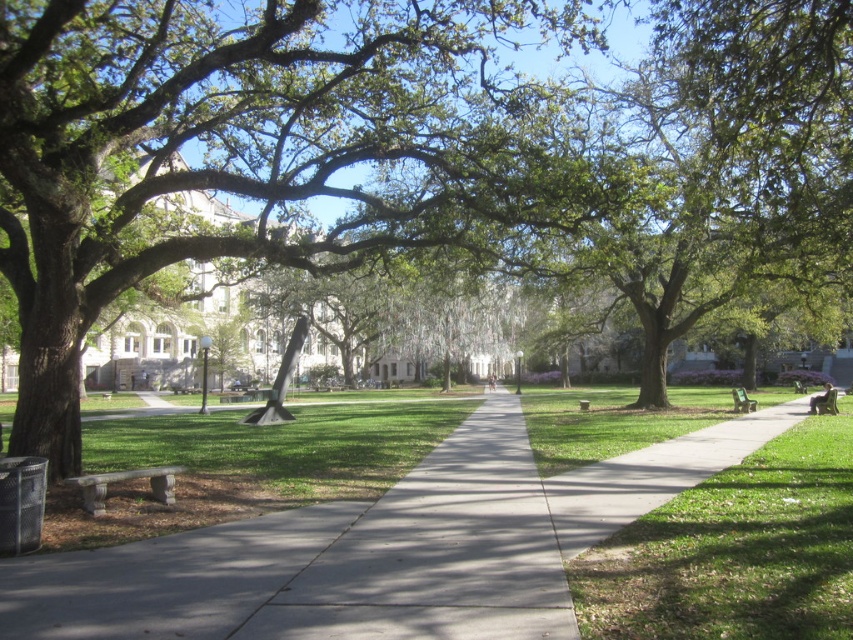
Does green leafy tree at center appear under green wooden bench at right?

No.

Is point (263, 221) in front of point (746, 396)?

Yes, point (263, 221) is closer to viewer.

Locate an element on the screen. Image resolution: width=853 pixels, height=640 pixels. green leafy tree at center is located at coordinates (248, 150).

Is point (738, 392) in front of point (587, 401)?

That is True.

Does green wooden bench at right appear under green stone bench at center?

No.

Is point (735, 394) positioned behind point (583, 401)?

No.

Image resolution: width=853 pixels, height=640 pixels. Identify the location of green wooden bench at right. (741, 401).

Find the location of a particular element. The image size is (853, 640). gray concrete sidewalk at center is located at coordinates (439, 552).